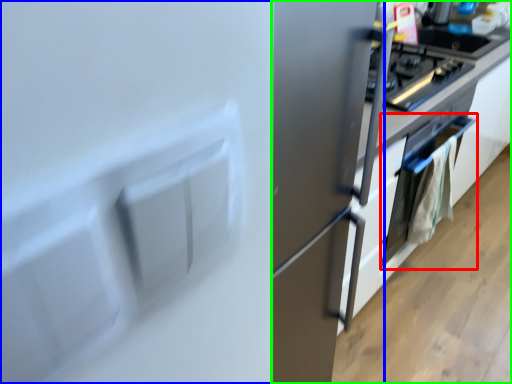
Question: Which is nearer to the oven (highlighted by a red box)? fridge (highlighted by a blue box) or cabinetry (highlighted by a green box).

Choices:
 (A) fridge
 (B) cabinetry

Answer: (B)